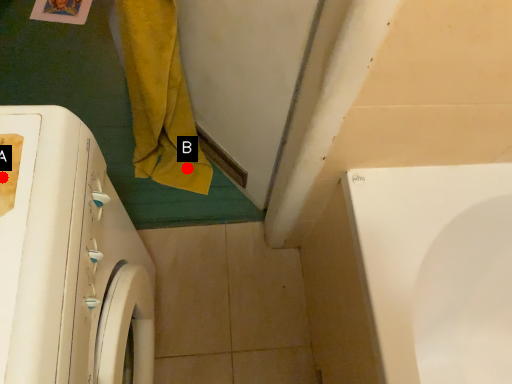
Question: Two points are circled on the image, labeled by A and B beside each circle. Which of the following is the closest to the observer?

Choices:
 (A) A is closer
 (B) B is closer

Answer: (A)